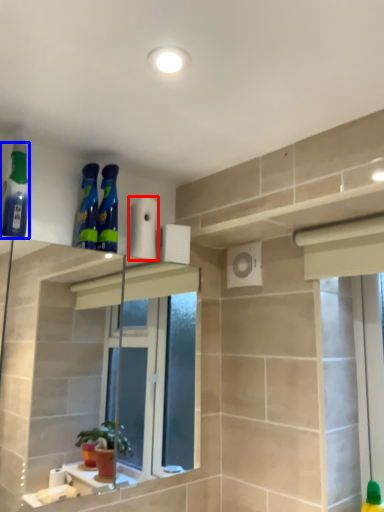
Question: Which object is further to the camera taking this photo, toilet paper (highlighted by a red box) or cleaning product (highlighted by a blue box)?

Choices:
 (A) toilet paper
 (B) cleaning product

Answer: (A)